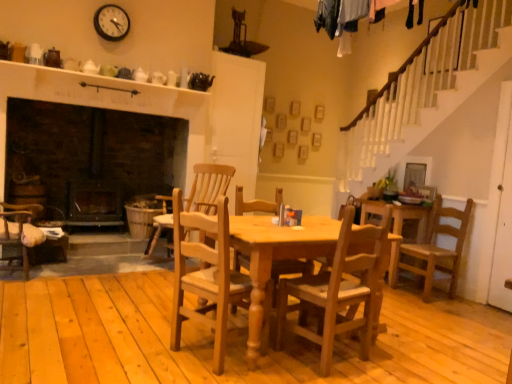
Where is `vacant space to the left of natural wood chair at center, which is counted as the 1th chair, starting from the front`? vacant space to the left of natural wood chair at center, which is counted as the 1th chair, starting from the front is located at coordinates tap(139, 349).